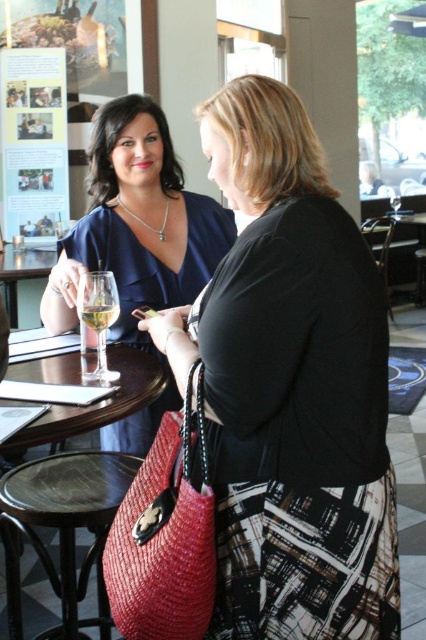
Question: Which of the following is the closest to the observer?

Choices:
 (A) rattan stool at lower left
 (B) matte black top at center

Answer: (B)

Question: Does transparent glass table at center have a smaller size compared to wooden stool at lower center?

Choices:
 (A) yes
 (B) no

Answer: (B)

Question: Is clear glass wine glass at left positioned behind translucent glass at upper left?

Choices:
 (A) yes
 (B) no

Answer: (A)

Question: Among these objects, which one is nearest to the camera?

Choices:
 (A) wooden stool at lower center
 (B) translucent glass at upper left

Answer: (B)

Question: Which point appears farthest from the camera in this image?

Choices:
 (A) (101, 312)
 (B) (89, 464)
 (C) (78, 314)
 (D) (111, 212)

Answer: (D)

Question: Can you confirm if clear glass at center is positioned below clear glass wine glass at left?

Choices:
 (A) yes
 (B) no

Answer: (A)